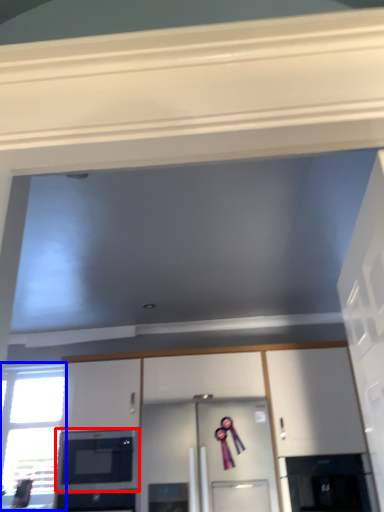
Question: Among these objects, which one is nearest to the camera, microwave oven (highlighted by a red box) or window (highlighted by a blue box)?

Choices:
 (A) microwave oven
 (B) window

Answer: (A)